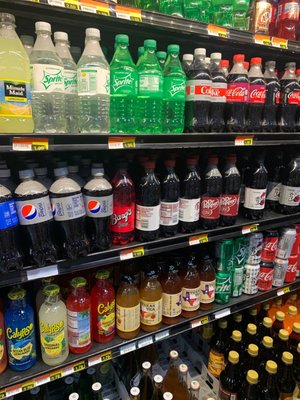
Identify the location of 4th shelf bottles. (17, 342), (47, 339), (75, 330), (110, 320), (155, 316), (131, 313), (170, 308), (190, 299), (210, 294).